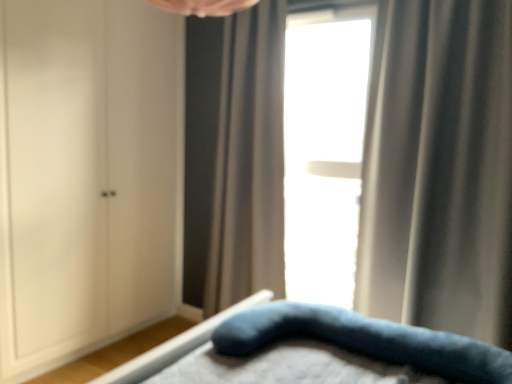
Question: From a real-world perspective, is gray textured curtain at center, the first curtain when ordered from back to front, beneath white matte cabinet at left?

Choices:
 (A) no
 (B) yes

Answer: (A)

Question: Can we say gray textured curtain at center, the first curtain when ordered from back to front, lies outside white matte cabinet at left?

Choices:
 (A) yes
 (B) no

Answer: (A)

Question: Does gray textured curtain at center, arranged as the 2th curtain when viewed from the front, have a smaller size compared to white matte cabinet at left?

Choices:
 (A) no
 (B) yes

Answer: (A)

Question: Can you confirm if gray textured curtain at center, the first curtain when ordered from back to front, is positioned to the left of white matte cabinet at left?

Choices:
 (A) yes
 (B) no

Answer: (B)

Question: Is gray textured curtain at center, which is counted as the 2th curtain, starting from the right, thinner than white matte cabinet at left?

Choices:
 (A) yes
 (B) no

Answer: (B)

Question: Is gray textured curtain at center, arranged as the 2th curtain when viewed from the front, shorter than white matte cabinet at left?

Choices:
 (A) no
 (B) yes

Answer: (B)

Question: Is the depth of velvety blue pillow at lower center less than that of silky gray curtain at right, the 2th curtain from the back?

Choices:
 (A) no
 (B) yes

Answer: (B)

Question: Can you confirm if velvety blue pillow at lower center is shorter than silky gray curtain at right, the first curtain from the right?

Choices:
 (A) yes
 (B) no

Answer: (A)

Question: Considering the relative sizes of velvety blue pillow at lower center and silky gray curtain at right, the first curtain from the right, in the image provided, is velvety blue pillow at lower center wider than silky gray curtain at right, the first curtain from the right,?

Choices:
 (A) no
 (B) yes

Answer: (B)

Question: From the image's perspective, would you say velvety blue pillow at lower center is shown under silky gray curtain at right, the 2th curtain from the back?

Choices:
 (A) no
 (B) yes

Answer: (B)

Question: Does velvety blue pillow at lower center appear on the left side of silky gray curtain at right, placed as the second curtain when sorted from left to right?

Choices:
 (A) yes
 (B) no

Answer: (A)

Question: Considering the relative sizes of velvety blue pillow at lower center and silky gray curtain at right, the first curtain from the right, in the image provided, is velvety blue pillow at lower center smaller than silky gray curtain at right, the first curtain from the right,?

Choices:
 (A) no
 (B) yes

Answer: (B)

Question: From the image's perspective, is gray textured curtain at center, arranged as the 2th curtain when viewed from the front, on transparent glass window at center?

Choices:
 (A) no
 (B) yes

Answer: (A)